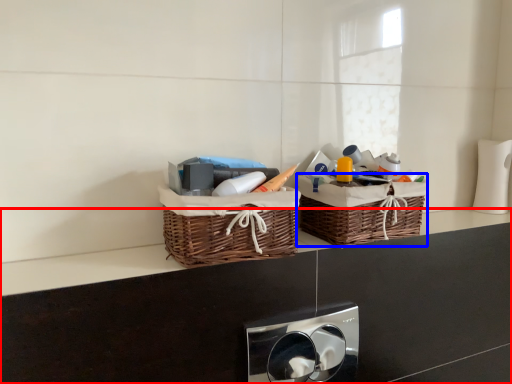
Question: Which object appears farthest to the camera in this image, counter (highlighted by a red box) or picnic basket (highlighted by a blue box)?

Choices:
 (A) counter
 (B) picnic basket

Answer: (B)